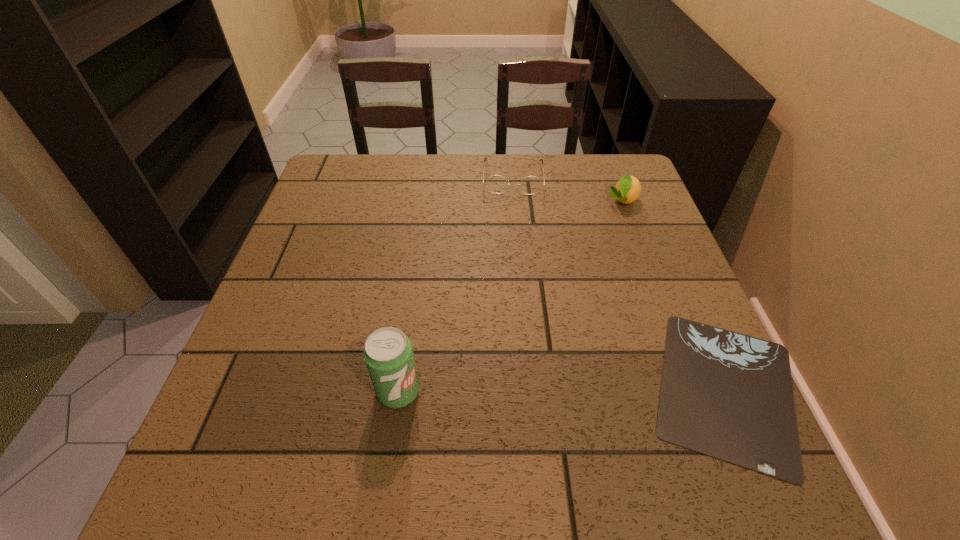
Where is `free point that satisfies the following two spatial constraints: 1. on the back side of the leftmost object; 2. on the left side of the shortest object`? The height and width of the screenshot is (540, 960). free point that satisfies the following two spatial constraints: 1. on the back side of the leftmost object; 2. on the left side of the shortest object is located at coordinates (398, 389).

The image size is (960, 540). Identify the location of vacant region that satisfies the following two spatial constraints: 1. on the back side of the leftmost object; 2. on the left side of the third shortest object. (425, 201).

Where is `vacant position in the image that satisfies the following two spatial constraints: 1. on the front side of the third shortest object; 2. on the left side of the second object from left to right`? The height and width of the screenshot is (540, 960). vacant position in the image that satisfies the following two spatial constraints: 1. on the front side of the third shortest object; 2. on the left side of the second object from left to right is located at coordinates (515, 201).

Find the location of a particular element. The height and width of the screenshot is (540, 960). vacant space that satisfies the following two spatial constraints: 1. on the back side of the tallest object; 2. on the left side of the third shortest object is located at coordinates (425, 201).